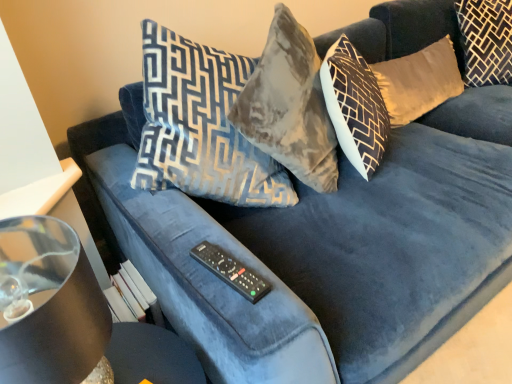
This screenshot has height=384, width=512. I want to click on free spot above transparent glass table at lower left (from a real-world perspective), so click(x=140, y=353).